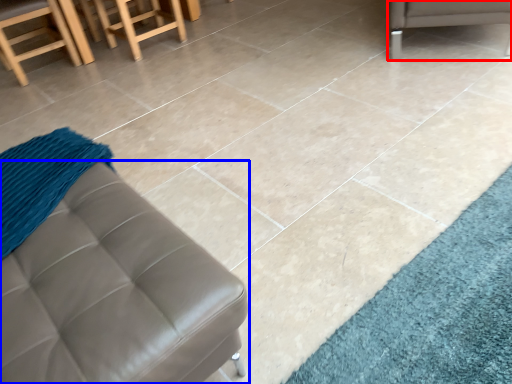
Question: Which of the following is the closest to the observer, furniture (highlighted by a red box) or furniture (highlighted by a blue box)?

Choices:
 (A) furniture
 (B) furniture

Answer: (B)